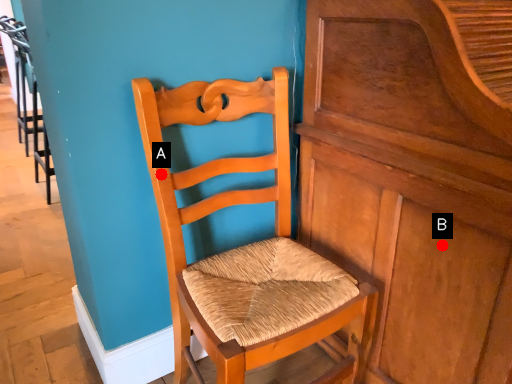
Question: Two points are circled on the image, labeled by A and B beside each circle. Among these points, which one is farthest from the camera?

Choices:
 (A) A is further
 (B) B is further

Answer: (A)